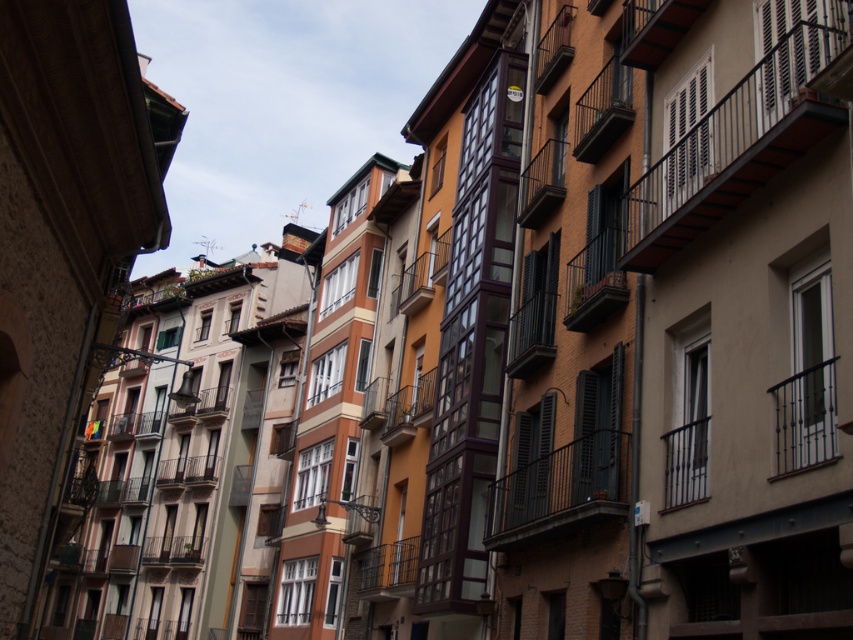
You are standing on the street looking at the row of buildings. There is a metallic black balcony at upper right marked by point [735,141]. Is this balcony part of the building on the far left or the building on the far right?

The metallic black balcony at upper right is represented by point [735,141], so it is part of the building on the far right.

You are standing on a street and see the black metal balcony at center. If you want to take a photo of it from where you are standing, will you need a zoom lens to capture the entire balcony in the frame?

The black metal balcony at center is 174.72 feet away from camera. Since it is quite far away, you would likely need a zoom lens to ensure the entire balcony fits within the camera frame.